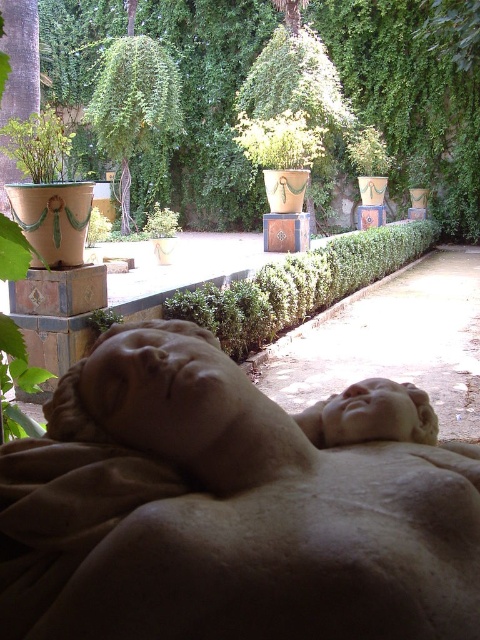
Question: Does smooth beige statue at center lie in front of green leafy plant at lower left?

Choices:
 (A) yes
 (B) no

Answer: (A)

Question: Is smooth beige statue at center further to the viewer compared to green leafy plant at lower left?

Choices:
 (A) yes
 (B) no

Answer: (B)

Question: Where is smooth beige statue at center located in relation to green leafy plant at lower left in the image?

Choices:
 (A) left
 (B) right

Answer: (B)

Question: Which object is positioned farthest from the green leafy hedge at upper center?

Choices:
 (A) green leafy plant at lower left
 (B) smooth beige statue at center

Answer: (A)

Question: Which object is positioned farthest from the green leafy plant at lower left?

Choices:
 (A) smooth beige statue at center
 (B) green leafy hedge at upper center

Answer: (B)

Question: Which object appears closest to the camera in this image?

Choices:
 (A) green leafy plant at lower left
 (B) smooth beige statue at center

Answer: (B)